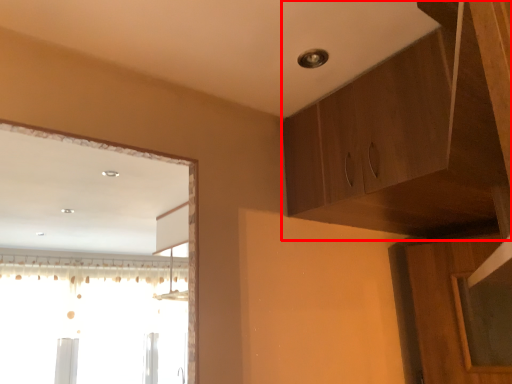
Question: From the image's perspective, what is the correct spatial relationship of cabinetry (annotated by the red box) in relation to window?

Choices:
 (A) below
 (B) above

Answer: (B)